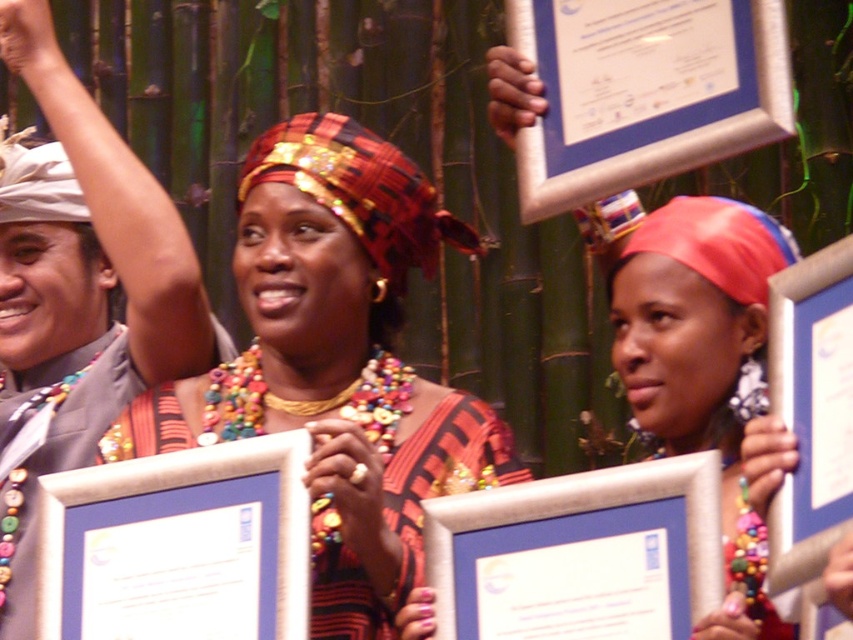
Question: Which of the following is the farthest from the observer?

Choices:
 (A) (216, 572)
 (B) (647, 608)

Answer: (A)

Question: Which of the following is the closest to the observer?

Choices:
 (A) matte silver picture frame at center
 (B) silver metallic picture frame at center

Answer: (B)

Question: Which object is farther from the camera taking this photo?

Choices:
 (A) silver metallic picture frame at center
 (B) matte fabric headscarf at center
 (C) matte silver picture frame at center

Answer: (B)

Question: Is matte silver picture frame at center positioned in front of silver metallic picture frame at center?

Choices:
 (A) no
 (B) yes

Answer: (A)

Question: Is matte fabric headscarf at center positioned in front of silver metallic picture frame at center?

Choices:
 (A) yes
 (B) no

Answer: (B)

Question: Does matte silver picture frame at center appear under silver metallic picture frame at center?

Choices:
 (A) no
 (B) yes

Answer: (B)